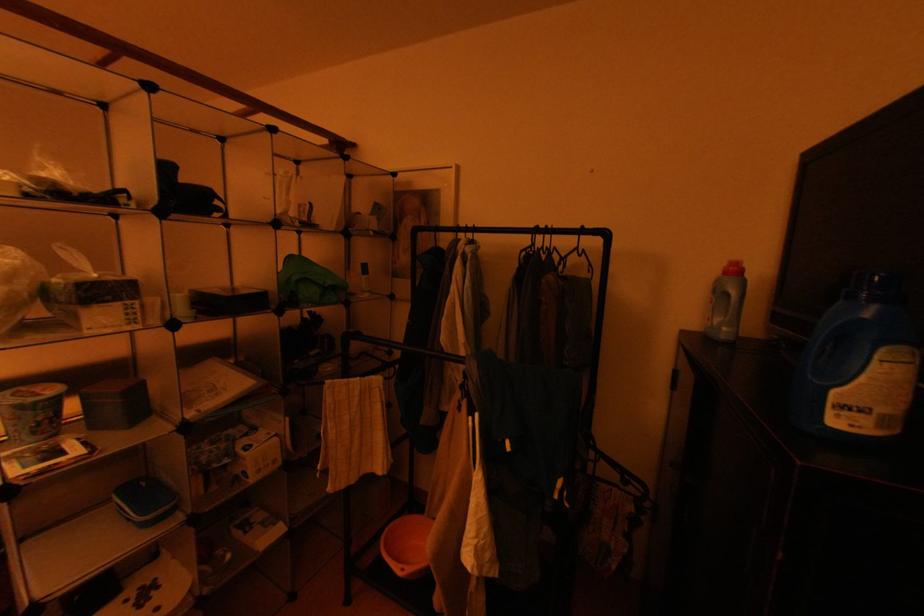
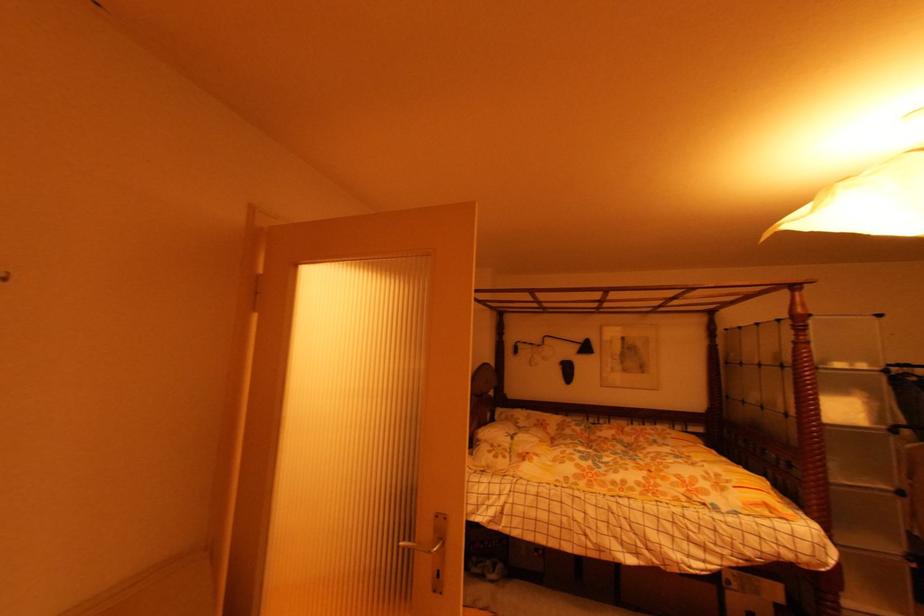
Question: In a continuous first-person perspective shot, in which direction is the camera moving?

Choices:
 (A) Left
 (B) Right
 (C) Forward
 (D) Backward

Answer: (A)